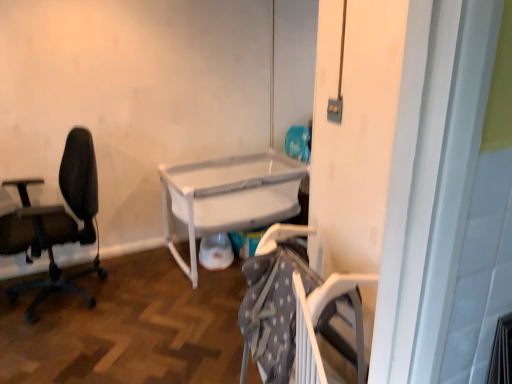
What are the coordinates of `empty space that is to the right of black mesh office chair at left` in the screenshot? It's located at (138, 305).